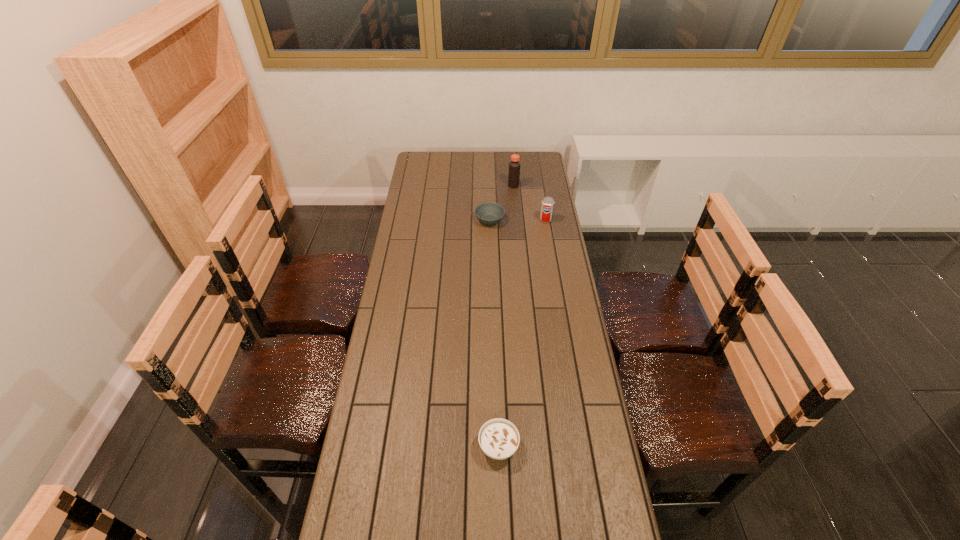
You are a GUI agent. You are given a task and a screenshot of the screen. Output one action in this format:
    pyautogui.click(x=<x>, y=<y>)
    Task: Click on the vacant point located between the farthest object and the nearer soup bowl
    
    Given the screenshot: What is the action you would take?
    pyautogui.click(x=506, y=316)

At what (x,y) coordinates should I click in order to perform the action: click on empty space that is in between the nearest object and the farthest object. Please return your answer as a coordinate pair (x, y). This screenshot has width=960, height=540. Looking at the image, I should click on 506,316.

You are a GUI agent. You are given a task and a screenshot of the screen. Output one action in this format:
    pyautogui.click(x=<x>, y=<y>)
    Task: Click on the free space between the nearer soup bowl and the rightmost object
    
    Given the screenshot: What is the action you would take?
    pyautogui.click(x=522, y=333)

At what (x,y) coordinates should I click in order to perform the action: click on empty space that is in between the farther soup bowl and the rightmost object. Please return your answer as a coordinate pair (x, y). Looking at the image, I should click on point(517,220).

This screenshot has height=540, width=960. I want to click on free space between the third shortest object and the tallest object, so click(x=530, y=202).

Identify which object is the third nearest to the nearest object. Please provide its 2D coordinates. Your answer should be formatted as a tuple, i.e. [(x, y)], where the tuple contains the x and y coordinates of a point satisfying the conditions above.

[(514, 166)]

Identify which object is located as the nearest to the tallest object. Please provide its 2D coordinates. Your answer should be formatted as a tuple, i.e. [(x, y)], where the tuple contains the x and y coordinates of a point satisfying the conditions above.

[(489, 213)]

You are a GUI agent. You are given a task and a screenshot of the screen. Output one action in this format:
    pyautogui.click(x=<x>, y=<y>)
    Task: Click on the free space that satisfies the following two spatial constraints: 1. on the back side of the tallest object; 2. on the left side of the farther soup bowl
    This screenshot has width=960, height=540.
    Given the screenshot: What is the action you would take?
    pyautogui.click(x=489, y=186)

The width and height of the screenshot is (960, 540). I want to click on blank space that satisfies the following two spatial constraints: 1. on the back side of the nearer soup bowl; 2. on the left side of the soda, so click(x=492, y=220).

The height and width of the screenshot is (540, 960). I want to click on free space that satisfies the following two spatial constraints: 1. on the back side of the farther soup bowl; 2. on the right side of the third object from left to right, so click(489, 186).